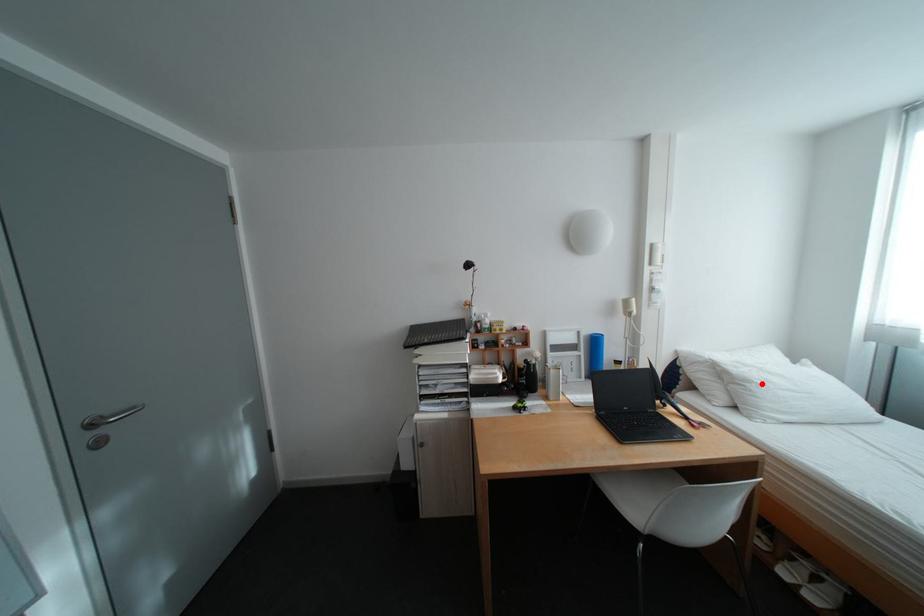
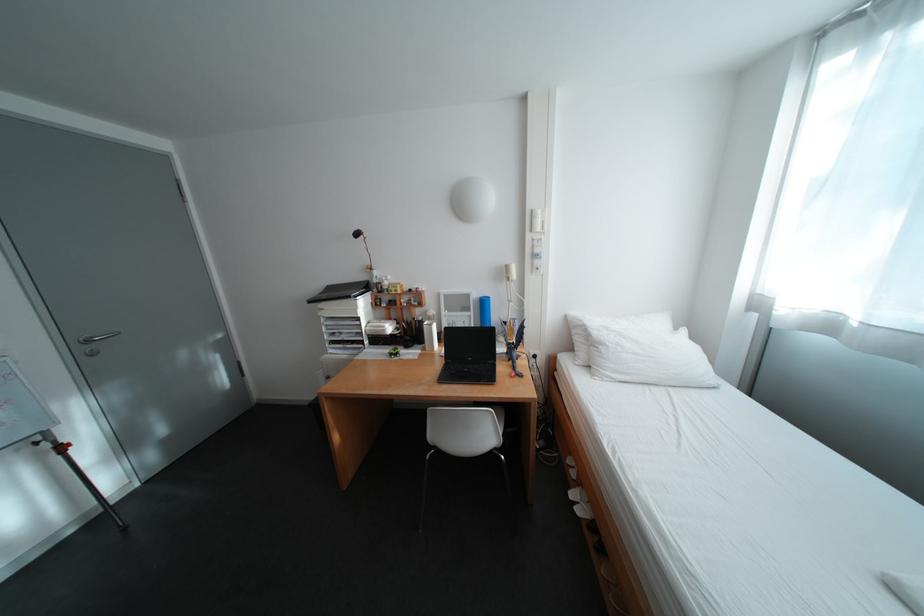
In the second image, find the point that corresponds to the highlighted location in the first image.

(614, 346)